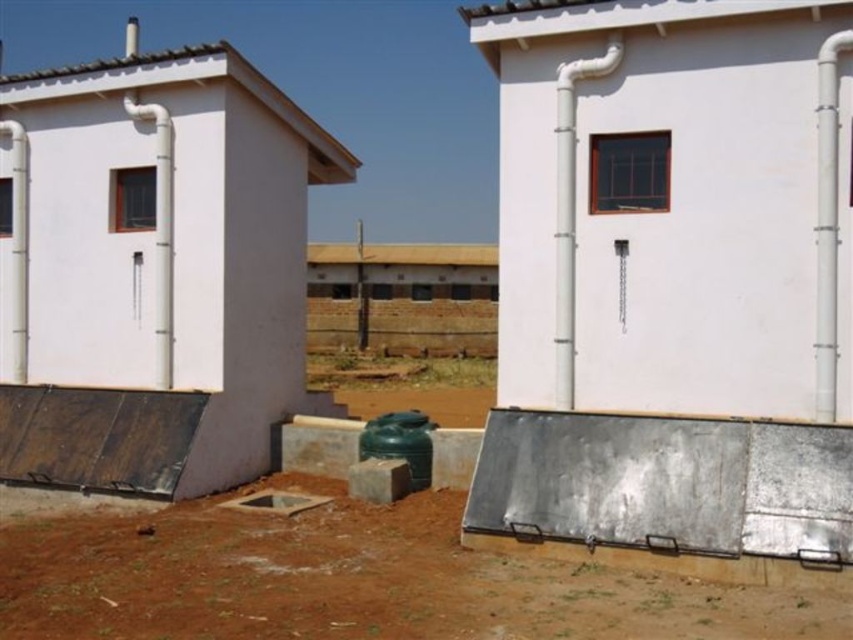
Does matte white hut at left have a smaller size compared to green matte water tank at center?

Incorrect, matte white hut at left is not smaller in size than green matte water tank at center.

Which of these two, matte white hut at left or green matte water tank at center, stands taller?

matte white hut at left is taller.

Is point (76, 243) positioned behind point (422, 429)?

Yes.

Where is `matte white hut at left`? This screenshot has height=640, width=853. matte white hut at left is located at coordinates (154, 269).

Does point (463, 620) come farther from viewer compared to point (367, 442)?

No, it is not.

Between brown dirt field at center and green matte water tank at center, which one has more height?

green matte water tank at center

Describe the element at coordinates (352, 580) in the screenshot. I see `brown dirt field at center` at that location.

In order to click on brown dirt field at center in this screenshot , I will do pos(352,580).

Can you confirm if white matte wall at center is smaller than matte white hut at left?

Correct, white matte wall at center occupies less space than matte white hut at left.

Which is below, white matte wall at center or matte white hut at left?

white matte wall at center

Does point (778, 365) come in front of point (264, 396)?

Yes.

This screenshot has height=640, width=853. I want to click on white matte wall at center, so click(674, 204).